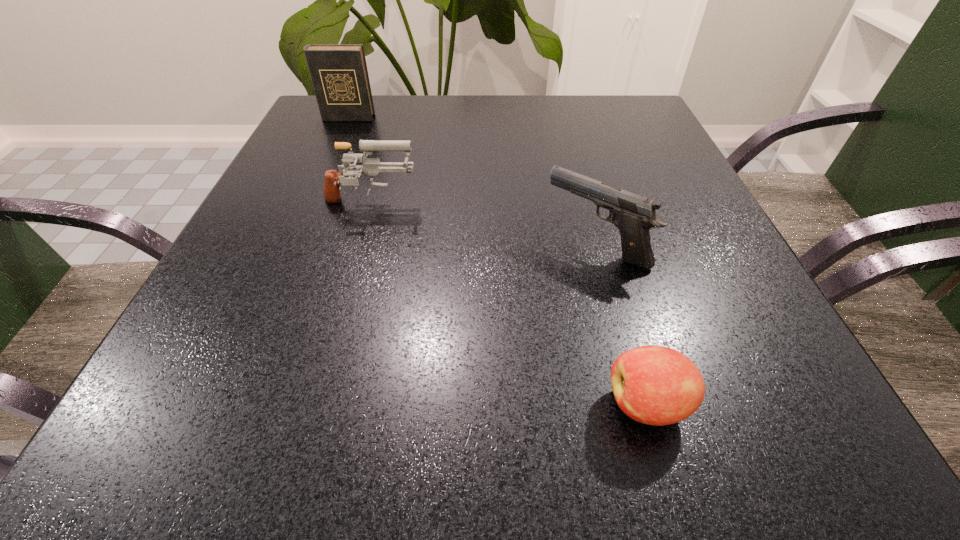
Find the location of a particular element. This screenshot has height=540, width=960. diary is located at coordinates (339, 74).

Where is `the tallest object`? This screenshot has width=960, height=540. the tallest object is located at coordinates (339, 74).

Find the location of a particular element. Image resolution: width=960 pixels, height=540 pixels. the left gun is located at coordinates [371, 166].

At what (x,y) coordinates should I click in order to perform the action: click on the right gun. Please return your answer as a coordinate pair (x, y). This screenshot has height=540, width=960. Looking at the image, I should click on (634, 215).

Where is `the shortest object`? This screenshot has width=960, height=540. the shortest object is located at coordinates (655, 385).

Where is `apple`? The height and width of the screenshot is (540, 960). apple is located at coordinates coord(655,385).

In order to click on vacant area situated 0.100m on the front cover of the diary in this screenshot , I will do `click(337, 143)`.

This screenshot has height=540, width=960. In order to click on vacant space located at the barrel end of the left gun in this screenshot , I will do `click(550, 205)`.

You are a GUI agent. You are given a task and a screenshot of the screen. Output one action in this format:
    pyautogui.click(x=<x>, y=<y>)
    Task: Click on the vacant space located 0.360m at the muzzle of the right gun
    
    Given the screenshot: What is the action you would take?
    click(x=334, y=245)

I want to click on free spot located 0.330m at the muzzle of the right gun, so click(x=351, y=245).